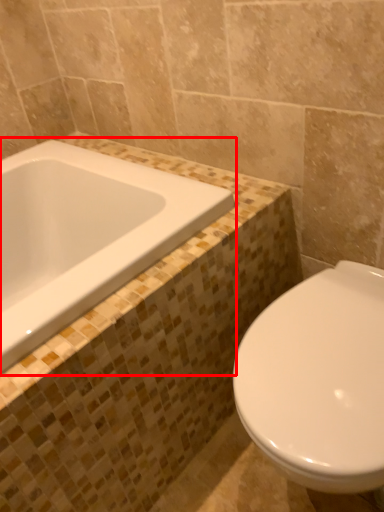
Question: Considering the relative positions of bathtub (annotated by the red box) and toilet in the image provided, where is bathtub (annotated by the red box) located with respect to the staircase?

Choices:
 (A) right
 (B) left

Answer: (B)